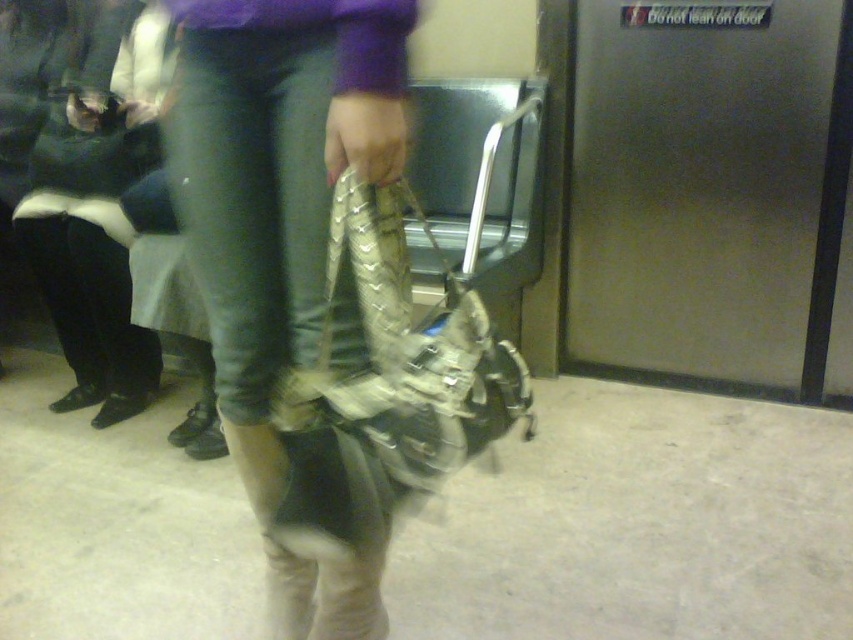
You are a security guard in the subway station. You need to locate the leather boots at center for a missing item report. What is their exact 2D coordinate position?

The leather boots at center are located at the 2D coordinate point of (x=281, y=230).